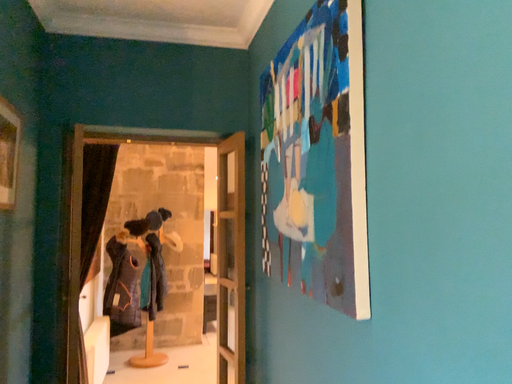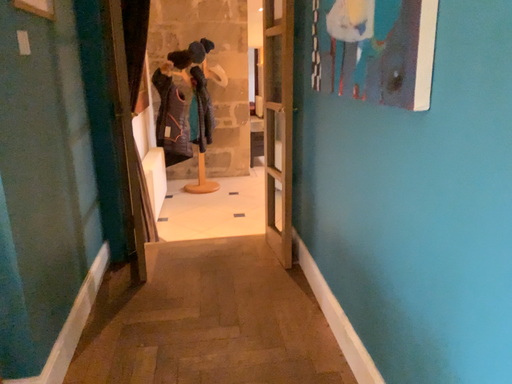
Question: How did the camera likely rotate when shooting the video?

Choices:
 (A) rotated upward
 (B) rotated downward

Answer: (B)